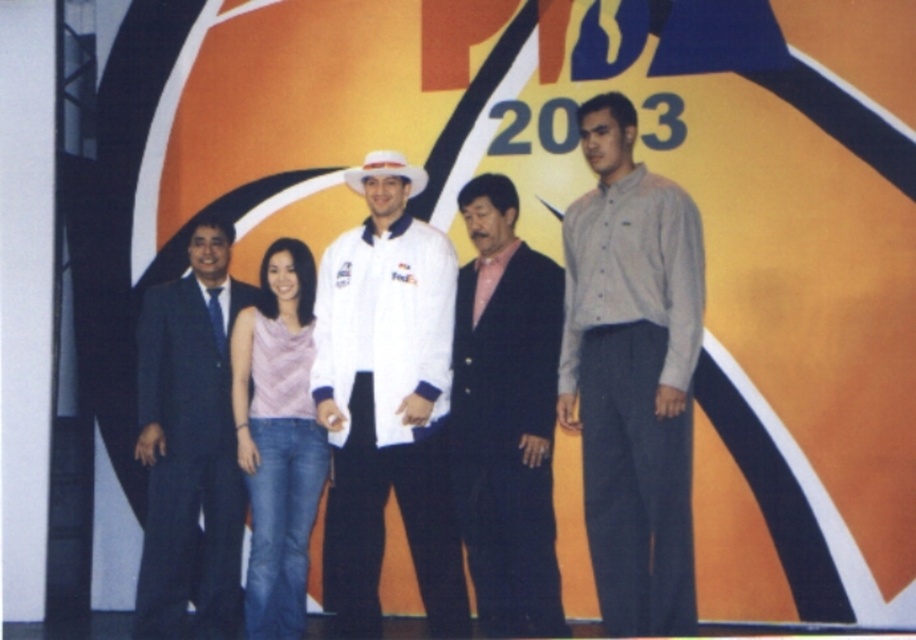
Does white matte jacket at center have a greater height compared to pink satin shirt at center?

Yes.

Describe the element at coordinates (388, 396) in the screenshot. The width and height of the screenshot is (916, 640). I see `white matte jacket at center` at that location.

Does point (416, 252) come in front of point (558, 285)?

No, (416, 252) is behind (558, 285).

At what (x,y) coordinates should I click in order to perform the action: click on white matte jacket at center. Please return your answer as a coordinate pair (x, y). This screenshot has width=916, height=640. Looking at the image, I should click on (388, 396).

Can you confirm if pink satin shirt at center is thinner than pink fabric top at center?

No.

Where is `pink satin shirt at center`? pink satin shirt at center is located at coordinates (506, 417).

Which is below, gray cotton shirt at right or pink satin shirt at center?

pink satin shirt at center

Between point (649, 236) and point (548, 268), which one is positioned in front?

Point (649, 236) is more forward.

The height and width of the screenshot is (640, 916). Describe the element at coordinates (631, 372) in the screenshot. I see `gray cotton shirt at right` at that location.

Locate an element on the screen. Image resolution: width=916 pixels, height=640 pixels. gray cotton shirt at right is located at coordinates (631, 372).